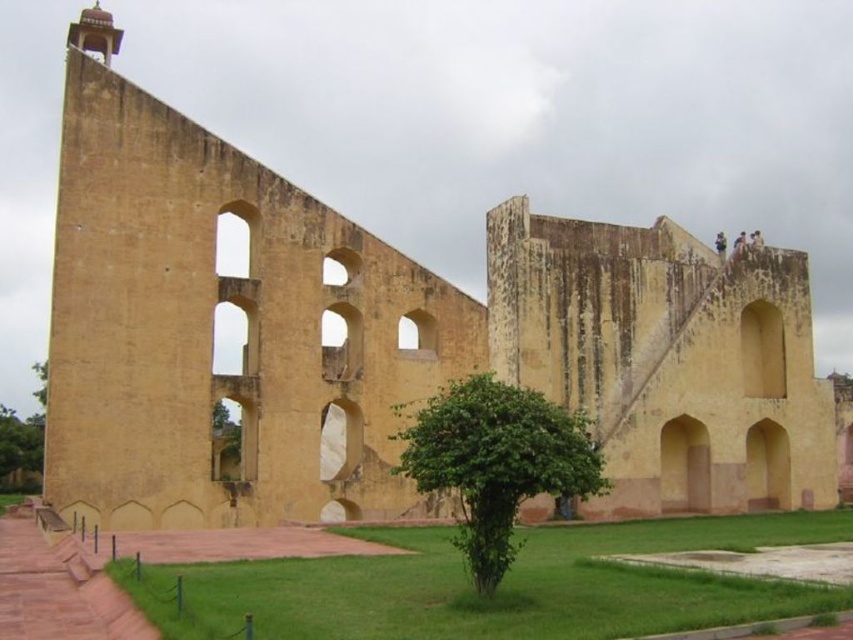
Does green leafy tree at center have a smaller size compared to green leafy tree at lower left?

Yes.

Between point (442, 444) and point (27, 465), which one is positioned in front?

Positioned in front is point (442, 444).

Where is `green leafy tree at center`? This screenshot has width=853, height=640. green leafy tree at center is located at coordinates (495, 461).